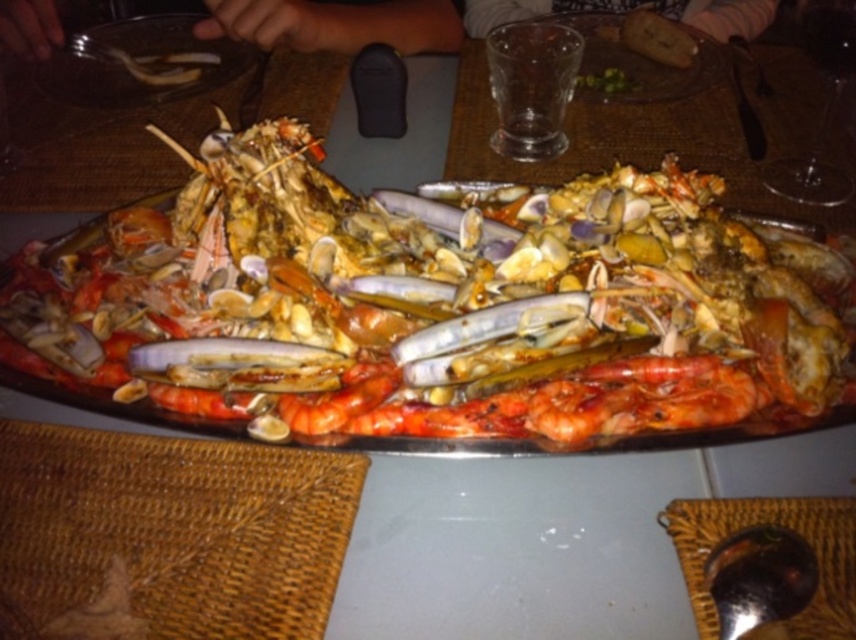
You are a server at a restaurant and need to place a new dish on the table. The dish is 10 cm in diameter. There is a space at the point labeled as point (141, 61). Is this space large enough to place the dish?

The space at point (141, 61) corresponds to the matte glass plate at upper left. Since the dish is 10 cm in diameter, and the glass plate is likely larger than 10 cm, it should fit.

In the scene shown: You are a server at a seafood restaurant. You need to place a new order of a 3cm tall appetizer on the table. Which object, the matte glass plate at upper left or the shiny red prawn at center, is more suitable for placing the appetizer to ensure it doesn

The matte glass plate at upper left has a greater height compared to the shiny red prawn at center, so placing the appetizer on the matte glass plate at upper left will ensure it is stable and elevated appropriately.

You are a server at a restaurant and need to place a new dish on the table. The dish is quite large and requires space in front of the shiny red prawns at center and the shiny red prawn at center. Can you fit it there?

The shiny red prawns at center is in front of the shiny red prawn at center, so there might not be enough space to fit the large dish in front of both objects.